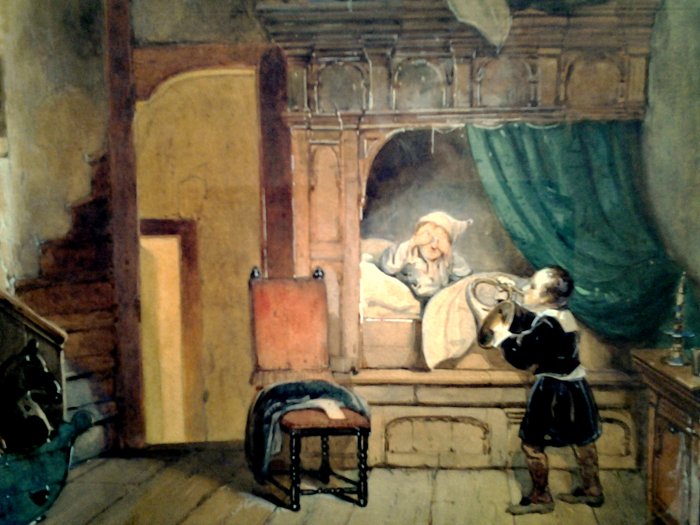
In order to click on rocking horse in this screenshot , I will do `click(43, 396)`.